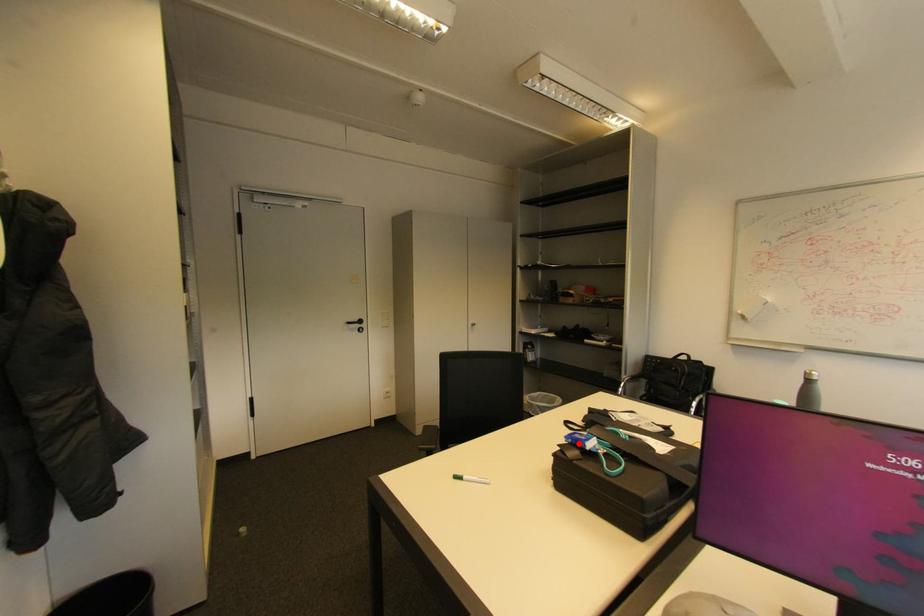
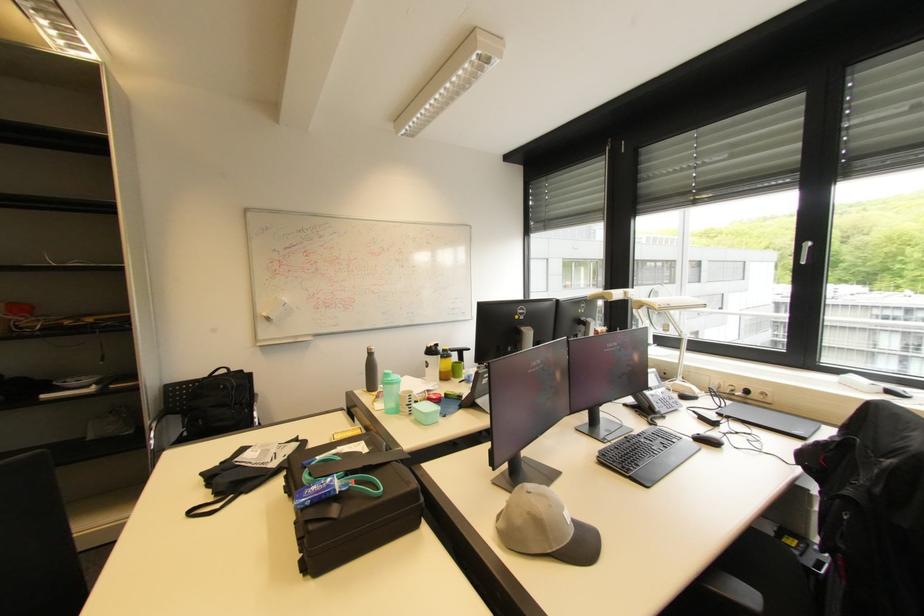
Locate, in the second image, the point that corresponds to the highlighted location in the first image.

(321, 501)